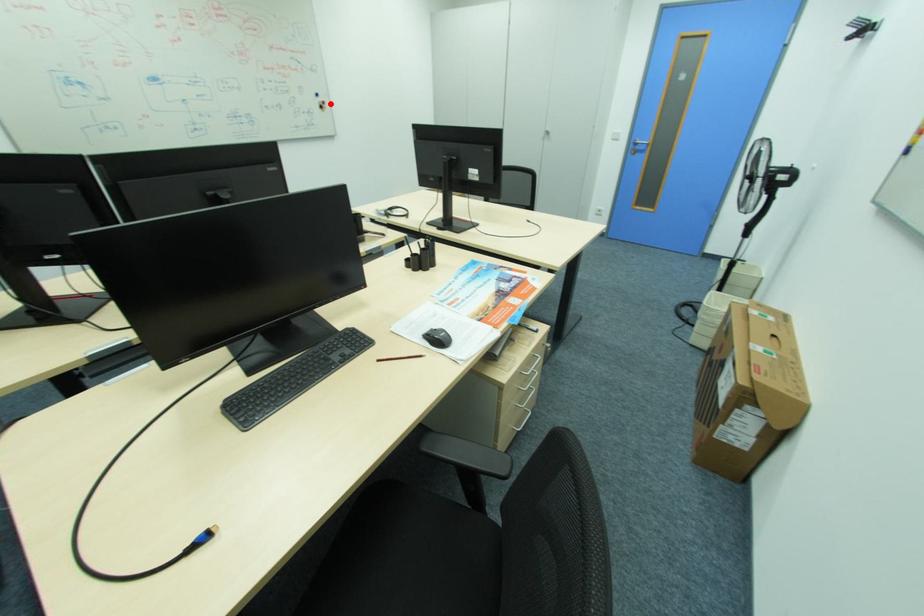
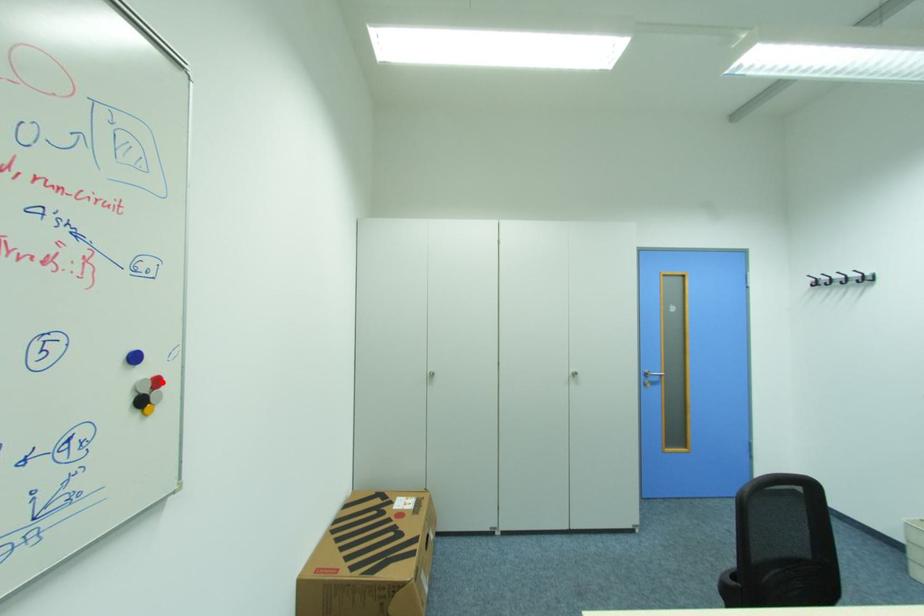
I am providing you with two images of the same scene from different viewpoints. A red point is marked on the first image and another point is marked on the second image. Is the marked point in image1 the same physical position as the marked point in image2?

Yes